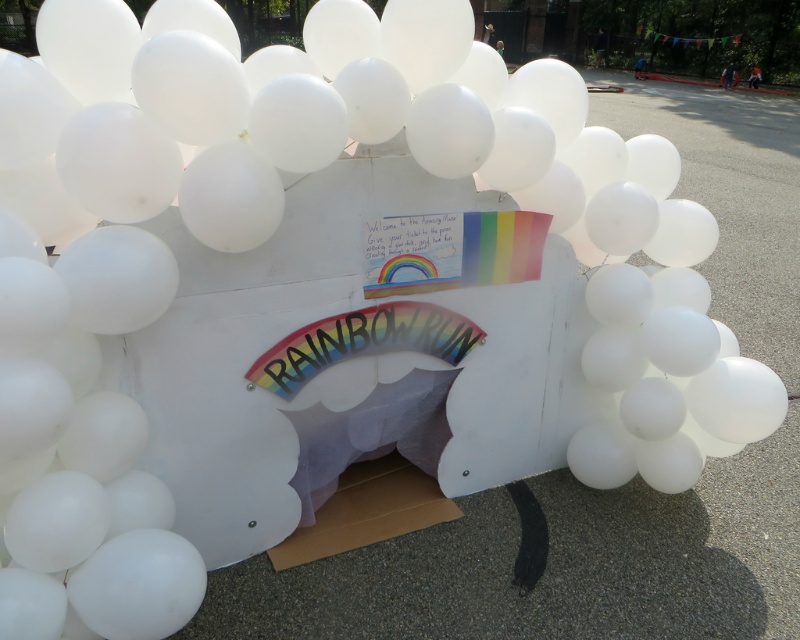
Which is behind, point (564, 360) or point (348, 486)?

The point (348, 486) is behind.

What are the coordinates of `white cardboard box at center` in the screenshot? It's located at (348, 360).